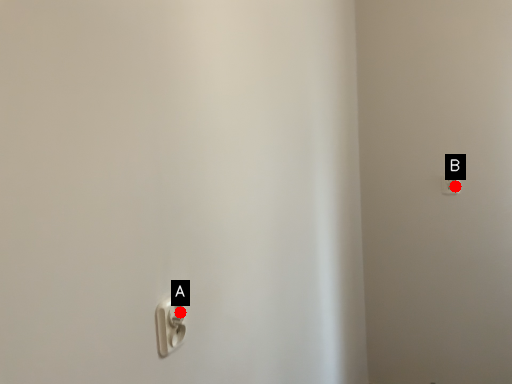
Question: Two points are circled on the image, labeled by A and B beside each circle. Which point is closer to the camera?

Choices:
 (A) A is closer
 (B) B is closer

Answer: (A)